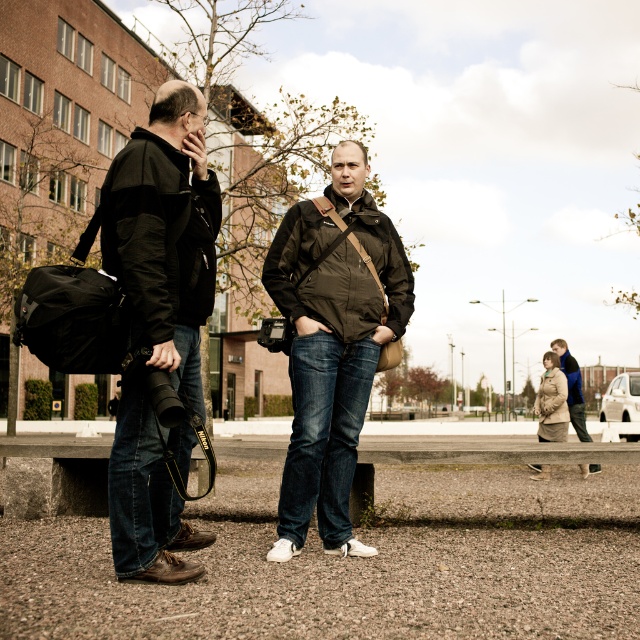
Question: Based on their relative distances, which object is farther from the beige wool coat at lower right?

Choices:
 (A) blue fleece jacket at lower right
 (B) matte black jacket at left
 (C) matte brown jacket at center
 (D) dark brown textured jacket at center

Answer: (B)

Question: Based on their relative distances, which object is nearer to the matte brown jacket at center?

Choices:
 (A) matte black jacket at left
 (B) beige wool coat at lower right

Answer: (A)

Question: Considering the relative positions of matte black jacket at left and brown textured jacket at lower right in the image provided, where is matte black jacket at left located with respect to brown textured jacket at lower right?

Choices:
 (A) left
 (B) right

Answer: (A)

Question: Among these objects, which one is farthest from the camera?

Choices:
 (A) matte brown jacket at center
 (B) blue fleece jacket at lower right
 (C) black matte jacket at left

Answer: (B)

Question: Is dark brown textured jacket at center below blue fleece jacket at lower right?

Choices:
 (A) yes
 (B) no

Answer: (B)

Question: Can you confirm if beige wool coat at lower right is positioned below brown textured jacket at lower right?

Choices:
 (A) no
 (B) yes

Answer: (A)